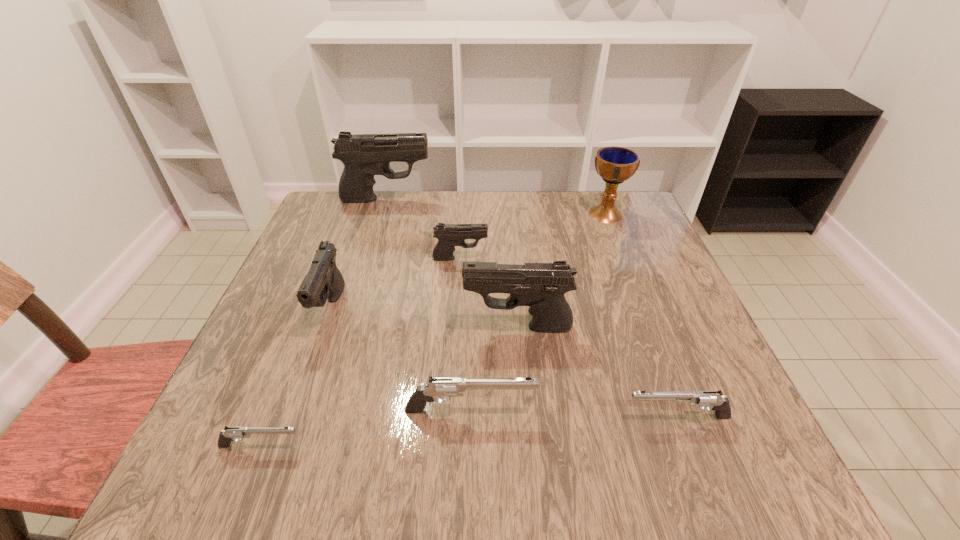
Where is `vacant area in the image that satisfies the following two spatial constraints: 1. at the barrel of the sixth nearest object; 2. at the barrel of the third biggest black pistol`? Image resolution: width=960 pixels, height=540 pixels. vacant area in the image that satisfies the following two spatial constraints: 1. at the barrel of the sixth nearest object; 2. at the barrel of the third biggest black pistol is located at coordinates (457, 309).

Image resolution: width=960 pixels, height=540 pixels. In order to click on vacant space that satisfies the following two spatial constraints: 1. at the barrel of the third biggest black pistol; 2. on the front-facing side of the nearest silver pistol in this screenshot , I will do `click(282, 446)`.